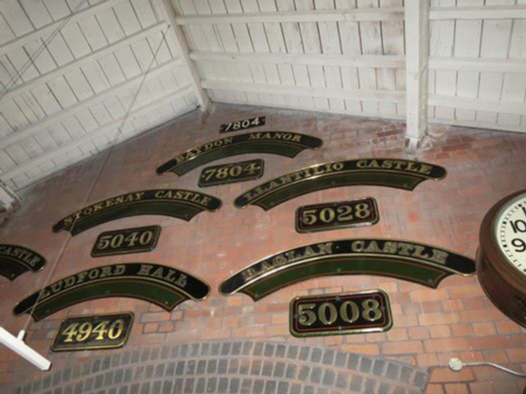
Identify the location of clock. The image size is (526, 394). (518, 227).